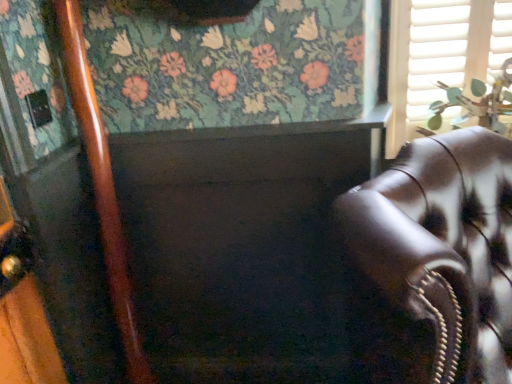
Measure the distance between green leafy plant at upper right and camera.

green leafy plant at upper right and camera are 1.29 meters apart.

What are the coordinates of `white matte shutter at upper right` in the screenshot? It's located at (437, 51).

The width and height of the screenshot is (512, 384). I want to click on leather couch at right, so click(x=443, y=247).

Which of these two, green leafy plant at upper right or leather couch at right, stands taller?

Standing taller between the two is leather couch at right.

I want to click on chair that appears below the green leafy plant at upper right (from a real-world perspective), so click(x=443, y=247).

Is green leafy plant at upper right not near leather couch at right?

No, green leafy plant at upper right is not far from leather couch at right.

Which point is more forward, (459, 101) or (451, 74)?

Point (459, 101)

Is green leafy plant at upper right touching white matte shutter at upper right?

No, green leafy plant at upper right is not with white matte shutter at upper right.

The width and height of the screenshot is (512, 384). What are the coordinates of `shutter located above the green leafy plant at upper right (from the image's perspective)` in the screenshot? It's located at (437, 51).

Which of these two, green leafy plant at upper right or white matte shutter at upper right, stands taller?

white matte shutter at upper right.

How many degrees apart are the facing directions of white matte shutter at upper right and green leafy plant at upper right?

There is a 2.26-degree angle between the facing directions of white matte shutter at upper right and green leafy plant at upper right.

From the image's perspective, would you say white matte shutter at upper right is positioned over green leafy plant at upper right?

Yes.

Between white matte shutter at upper right and green leafy plant at upper right, which one has more height?

With more height is white matte shutter at upper right.

Is white matte shutter at upper right further to the viewer compared to green leafy plant at upper right?

Yes, white matte shutter at upper right is further from the viewer.

Identify the location of chair located underneath the white matte shutter at upper right (from a real-world perspective). (443, 247).

Considering the relative positions of leather couch at right and white matte shutter at upper right in the image provided, is leather couch at right to the left of white matte shutter at upper right from the viewer's perspective?

Yes.

Does leather couch at right have a greater height compared to white matte shutter at upper right?

Yes.

How far apart are leather couch at right and white matte shutter at upper right?

A distance of 59.73 centimeters exists between leather couch at right and white matte shutter at upper right.

Relative to leather couch at right, is white matte shutter at upper right in front or behind?

white matte shutter at upper right is positioned farther from the viewer than leather couch at right.

Is white matte shutter at upper right oriented towards leather couch at right?

Yes.

This screenshot has width=512, height=384. I want to click on shutter located above the leather couch at right (from the image's perspective), so click(437, 51).

Considering the relative positions of white matte shutter at upper right and leather couch at right in the image provided, is white matte shutter at upper right to the left or to the right of leather couch at right?

In the image, white matte shutter at upper right appears on the right side of leather couch at right.

From the image's perspective, which one is positioned higher, leather couch at right or green leafy plant at upper right?

green leafy plant at upper right appears higher in the image.

Is green leafy plant at upper right at the back of leather couch at right?

Correct, leather couch at right is looking away from green leafy plant at upper right.

From their relative heights in the image, would you say leather couch at right is taller or shorter than green leafy plant at upper right?

leather couch at right is taller than green leafy plant at upper right.

The height and width of the screenshot is (384, 512). In the image, there is a green leafy plant at upper right. What are the coordinates of `chair below it (from a real-world perspective)` in the screenshot? It's located at (443, 247).

Locate an element on the screen. shutter that is behind the green leafy plant at upper right is located at coordinates (437, 51).

From the image, which object appears to be farther from leather couch at right, white matte shutter at upper right or green leafy plant at upper right?

white matte shutter at upper right is positioned further to the anchor leather couch at right.

Looking at the image, which one is located further to white matte shutter at upper right, leather couch at right or green leafy plant at upper right?

leather couch at right.

Based on their spatial positions, is leather couch at right or white matte shutter at upper right further from green leafy plant at upper right?

Based on the image, leather couch at right appears to be further to green leafy plant at upper right.

Estimate the real-world distances between objects in this image. Which object is closer to green leafy plant at upper right, white matte shutter at upper right or leather couch at right?

white matte shutter at upper right is closer to green leafy plant at upper right.

Looking at the image, which one is located closer to leather couch at right, green leafy plant at upper right or white matte shutter at upper right?

The object closer to leather couch at right is green leafy plant at upper right.

When comparing their distances from white matte shutter at upper right, does green leafy plant at upper right or leather couch at right seem further?

Among the two, leather couch at right is located further to white matte shutter at upper right.

Find the location of `plant between leather couch at right and white matte shutter at upper right along the z-axis`. plant between leather couch at right and white matte shutter at upper right along the z-axis is located at coordinates (476, 103).